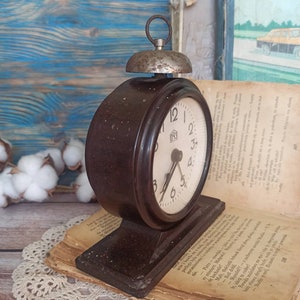
This screenshot has width=300, height=300. I want to click on alarm bell, so click(155, 60).